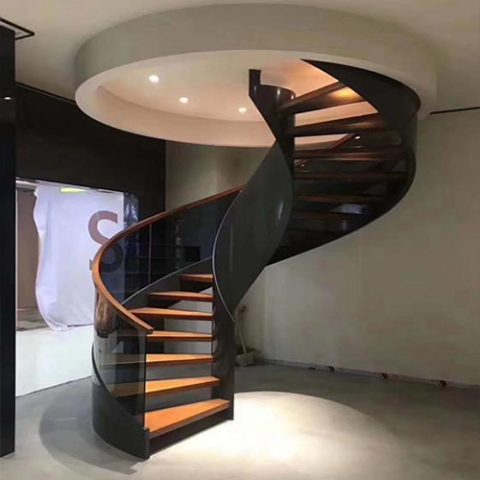
At what (x,y) coordinates should I click in order to perform the action: click on ceiling. Please return your answer as a coordinate pair (x, y). This screenshot has width=480, height=480. Looking at the image, I should click on (52, 50), (455, 24), (457, 92).